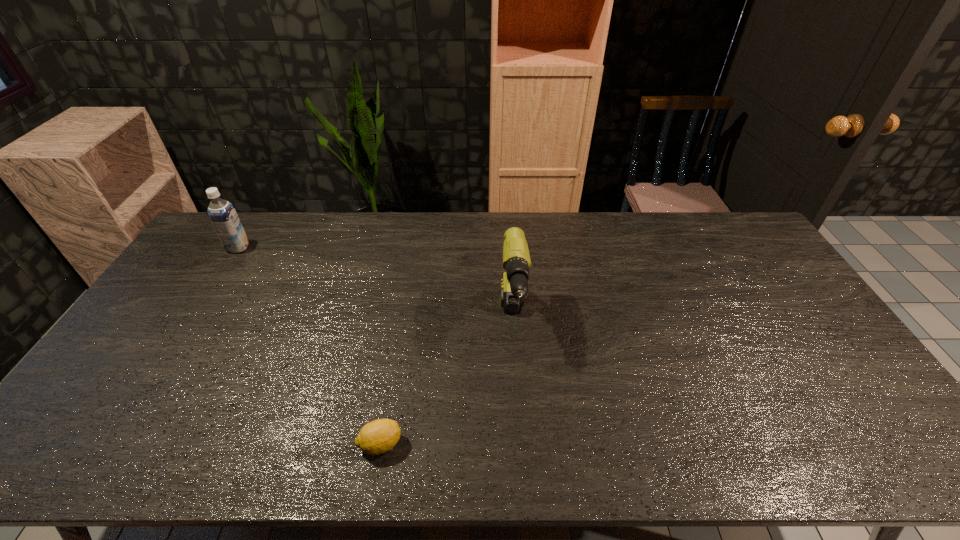
Select which object is the second closest to the rightmost object. Please provide its 2D coordinates. Your answer should be formatted as a tuple, i.e. [(x, y)], where the tuple contains the x and y coordinates of a point satisfying the conditions above.

[(222, 214)]

You are a GUI agent. You are given a task and a screenshot of the screen. Output one action in this format:
    pyautogui.click(x=<x>, y=<y>)
    Task: Click on the vacant space that satisfies the following two spatial constraints: 1. on the handle side of the second farthest object; 2. at the stem end of the second object from left to right
    The image size is (960, 540).
    Given the screenshot: What is the action you would take?
    pyautogui.click(x=521, y=444)

This screenshot has height=540, width=960. Identify the location of vacant region that satisfies the following two spatial constraints: 1. on the handle side of the drill; 2. at the stem end of the nearest object. (521, 444).

Where is `free space that satisfies the following two spatial constraints: 1. on the handle side of the rightmost object; 2. at the stem end of the shortest object`? free space that satisfies the following two spatial constraints: 1. on the handle side of the rightmost object; 2. at the stem end of the shortest object is located at coordinates (521, 444).